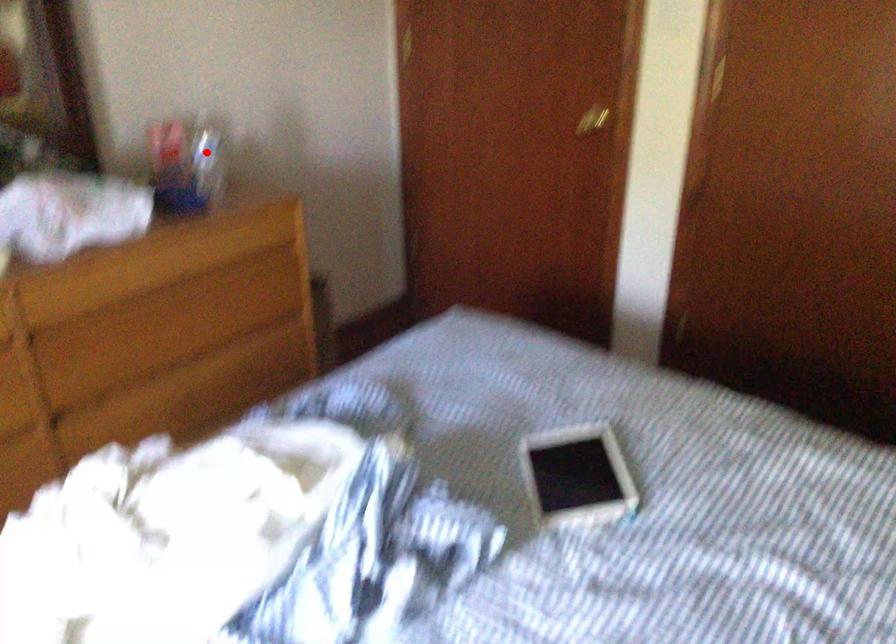
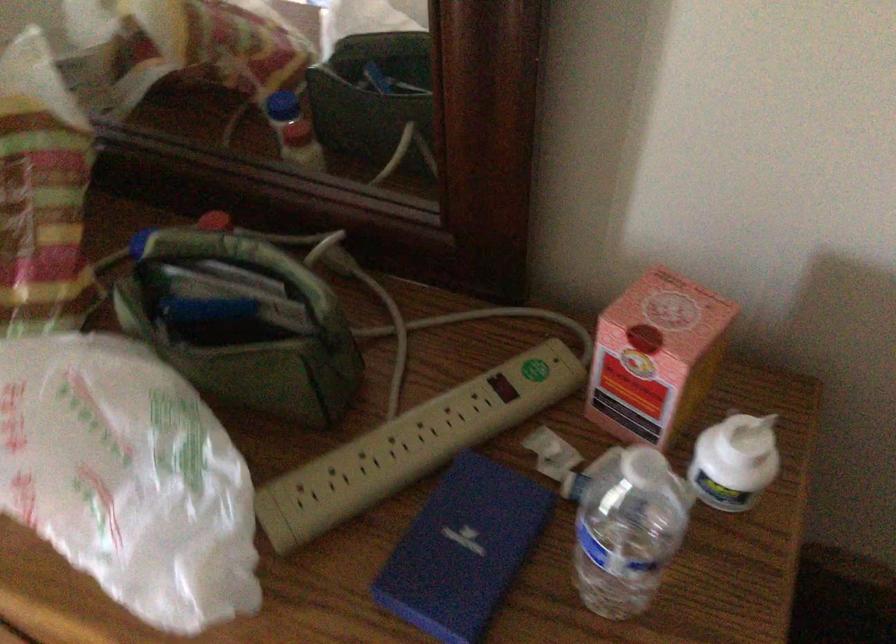
Question: A red point is marked in image1. In image2, is the corresponding 3D point closer to the camera or farther? Reply with the corresponding letter.

Choices:
 (A) The corresponding 3D point is closer.
 (B) The corresponding 3D point is farther.

Answer: (A)